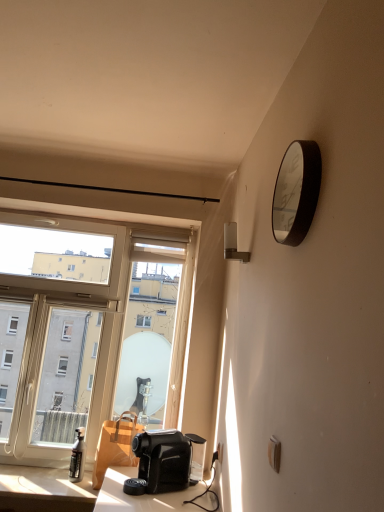
This screenshot has height=512, width=384. I want to click on free spot above matte black table at lower left (from a real-world perspective), so click(42, 475).